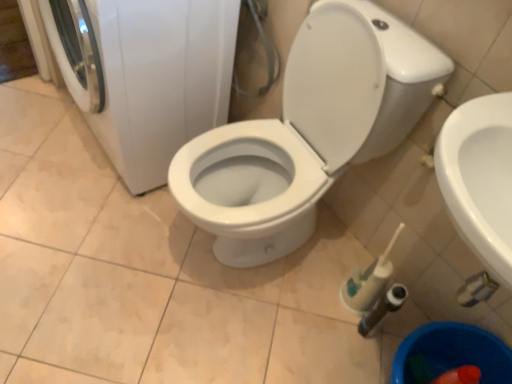
Question: Is white glossy toilet at center shorter than white glossy washing machine at left?

Choices:
 (A) no
 (B) yes

Answer: (A)

Question: From a real-world perspective, is white glossy toilet at center on white glossy washing machine at left?

Choices:
 (A) yes
 (B) no

Answer: (A)

Question: Does white glossy toilet at center turn towards white glossy washing machine at left?

Choices:
 (A) yes
 (B) no

Answer: (B)

Question: Could white glossy washing machine at left be considered to be inside white glossy toilet at center?

Choices:
 (A) no
 (B) yes

Answer: (A)

Question: From a real-world perspective, is white glossy toilet at center positioned under white glossy washing machine at left based on gravity?

Choices:
 (A) no
 (B) yes

Answer: (A)

Question: Does white glossy toilet at center appear on the left side of white glossy washing machine at left?

Choices:
 (A) yes
 (B) no

Answer: (B)

Question: From a real-world perspective, does white glossy washing machine at left sit lower than white glossy toilet at center?

Choices:
 (A) no
 (B) yes

Answer: (B)

Question: Are white glossy washing machine at left and white glossy toilet at center located far from each other?

Choices:
 (A) yes
 (B) no

Answer: (B)

Question: Does white glossy washing machine at left have a greater width compared to white glossy toilet at center?

Choices:
 (A) no
 (B) yes

Answer: (A)

Question: Is white glossy washing machine at left positioned in front of white glossy toilet at center?

Choices:
 (A) no
 (B) yes

Answer: (A)

Question: Is white glossy washing machine at left to the right of white glossy toilet at center from the viewer's perspective?

Choices:
 (A) yes
 (B) no

Answer: (B)

Question: Can you confirm if white glossy washing machine at left is bigger than white glossy toilet at center?

Choices:
 (A) yes
 (B) no

Answer: (A)

Question: Is white glossy toilet at center wider or thinner than white glossy washing machine at left?

Choices:
 (A) wide
 (B) thin

Answer: (A)